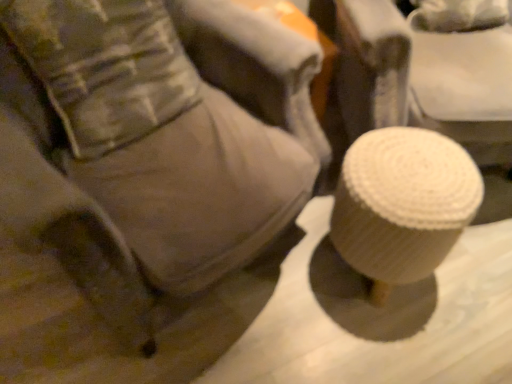
Question: Is white textured stool at lower right taller than camouflage fabric pillow at upper left?

Choices:
 (A) no
 (B) yes

Answer: (B)

Question: Is white textured stool at lower right to the right of camouflage fabric pillow at upper left from the viewer's perspective?

Choices:
 (A) no
 (B) yes

Answer: (B)

Question: From a real-world perspective, is white textured stool at lower right on top of camouflage fabric pillow at upper left?

Choices:
 (A) yes
 (B) no

Answer: (B)

Question: Is white textured stool at lower right located outside camouflage fabric pillow at upper left?

Choices:
 (A) yes
 (B) no

Answer: (A)

Question: From the image's perspective, is white textured stool at lower right under camouflage fabric pillow at upper left?

Choices:
 (A) no
 (B) yes

Answer: (B)

Question: Can you confirm if white textured stool at lower right is thinner than camouflage fabric pillow at upper left?

Choices:
 (A) yes
 (B) no

Answer: (B)

Question: Considering the relative positions of camouflage fabric pillow at upper left and white textured stool at lower right in the image provided, is camouflage fabric pillow at upper left to the right of white textured stool at lower right from the viewer's perspective?

Choices:
 (A) yes
 (B) no

Answer: (B)

Question: Considering the relative positions of camouflage fabric pillow at upper left and white textured stool at lower right in the image provided, is camouflage fabric pillow at upper left to the left of white textured stool at lower right from the viewer's perspective?

Choices:
 (A) yes
 (B) no

Answer: (A)

Question: Is camouflage fabric pillow at upper left shorter than white textured stool at lower right?

Choices:
 (A) no
 (B) yes

Answer: (B)

Question: From the image's perspective, is camouflage fabric pillow at upper left on top of white textured stool at lower right?

Choices:
 (A) no
 (B) yes

Answer: (B)

Question: Considering the relative positions of camouflage fabric pillow at upper left and white textured stool at lower right in the image provided, is camouflage fabric pillow at upper left in front of white textured stool at lower right?

Choices:
 (A) yes
 (B) no

Answer: (B)

Question: From a real-world perspective, is camouflage fabric pillow at upper left under white textured stool at lower right?

Choices:
 (A) yes
 (B) no

Answer: (B)

Question: Considering the positions of white textured stool at lower right and camouflage fabric pillow at upper left in the image, is white textured stool at lower right wider or thinner than camouflage fabric pillow at upper left?

Choices:
 (A) thin
 (B) wide

Answer: (B)